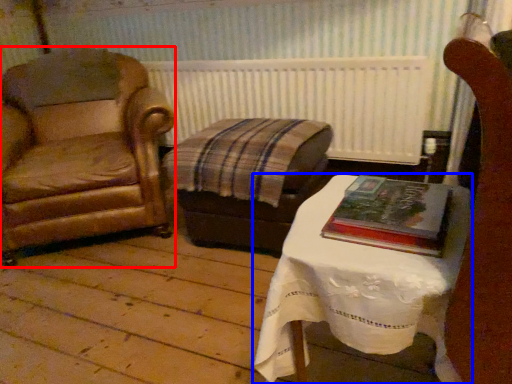
Question: Which object is closer to the camera taking this photo, chair (highlighted by a red box) or table (highlighted by a blue box)?

Choices:
 (A) chair
 (B) table

Answer: (B)